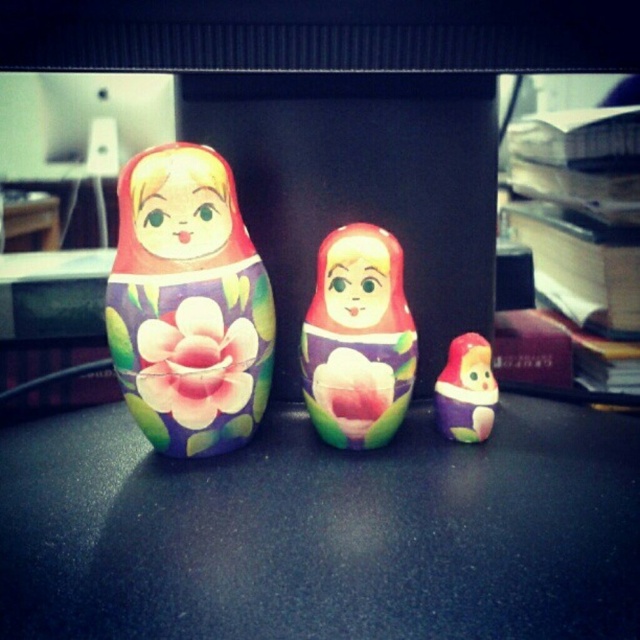
Is matte painted doll at left taller than matte painted doll at center?

Yes, matte painted doll at left is taller than matte painted doll at center.

Is matte painted doll at left smaller than matte painted doll at center?

No.

Is point (225, 419) positioned behind point (394, 340)?

No, (225, 419) is closer to viewer.

This screenshot has width=640, height=640. I want to click on matte painted doll at left, so click(x=188, y=305).

Does matte black table at center have a larger size compared to matte painted doll at center?

Yes, matte black table at center is bigger than matte painted doll at center.

Is matte black table at center to the right of matte painted doll at center from the viewer's perspective?

Incorrect, matte black table at center is not on the right side of matte painted doll at center.

Describe the element at coordinates (323, 531) in the screenshot. I see `matte black table at center` at that location.

The width and height of the screenshot is (640, 640). In order to click on matte black table at center in this screenshot , I will do `click(323, 531)`.

Describe the element at coordinates (356, 339) in the screenshot. The image size is (640, 640). I see `matte painted doll at center` at that location.

Image resolution: width=640 pixels, height=640 pixels. I want to click on matte painted doll at center, so click(356, 339).